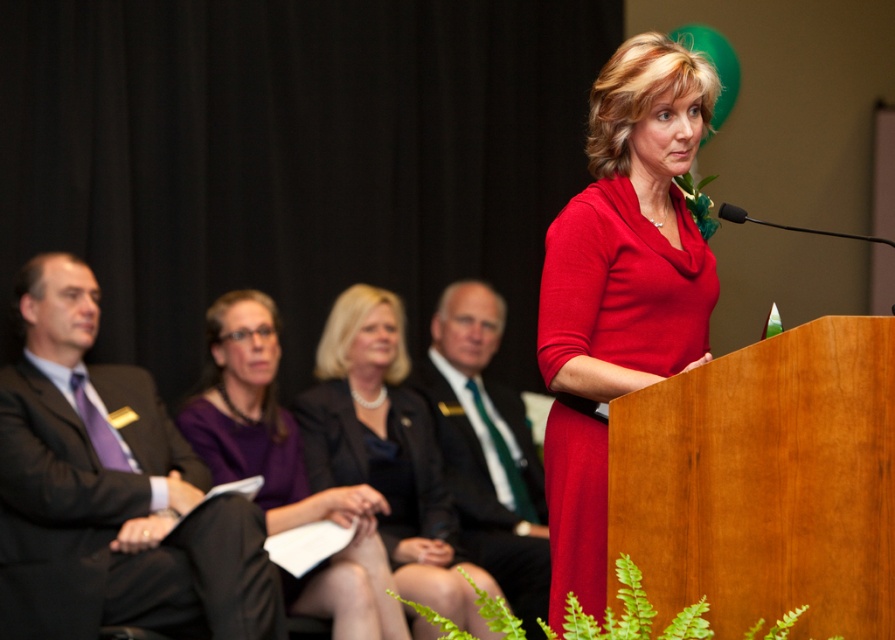
Who is more forward, (64, 518) or (424, 413)?

Point (64, 518) is more forward.

Measure the distance between point (215, 605) and camera.

They are 3.09 meters apart.

Does point (168, 424) lie in front of point (424, 416)?

Yes, it is in front of point (424, 416).

This screenshot has height=640, width=895. In order to click on matte black suit at left in this screenshot , I will do (x=124, y=515).

Who is shorter, matte black suit at center or green silk tie at center?

With less height is matte black suit at center.

Measure the distance between matte black suit at center and camera.

11.34 feet

Where is `matte black suit at center`? This screenshot has width=895, height=640. matte black suit at center is located at coordinates coord(386,451).

Who is higher up, matte black suit at left or green silk tie at center?

green silk tie at center is higher up.

This screenshot has height=640, width=895. Find the location of `matte black suit at left`. matte black suit at left is located at coordinates tap(124, 515).